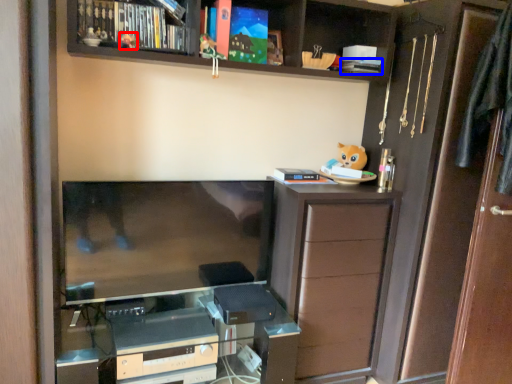
Question: Which object appears closest to the camera in this image, toy (highlighted by a red box) or book (highlighted by a blue box)?

Choices:
 (A) toy
 (B) book

Answer: (A)